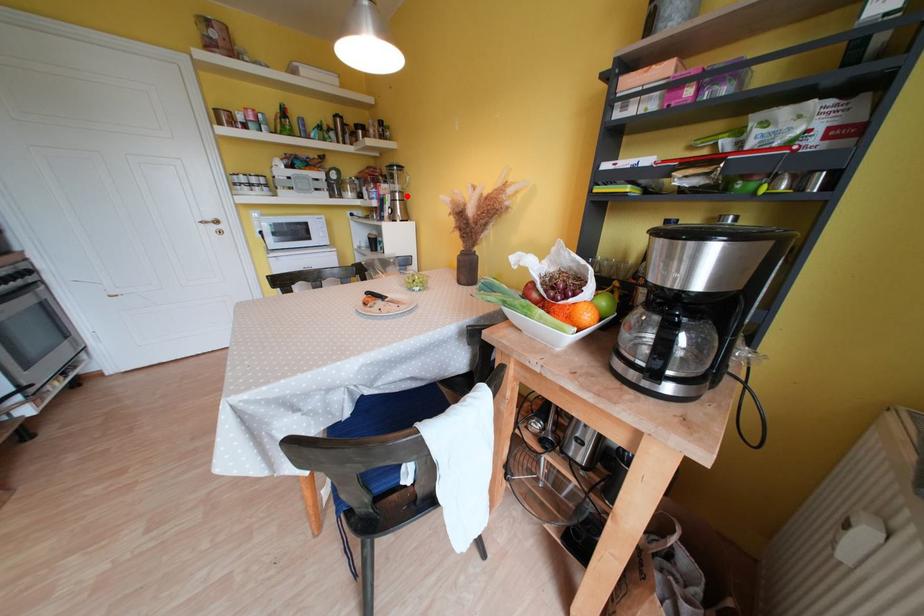
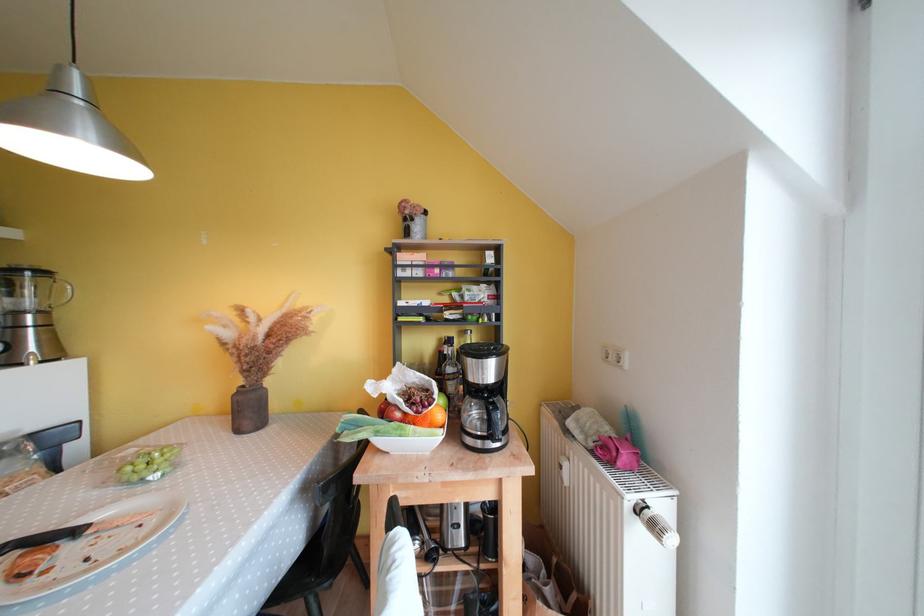
Locate, in the second image, the point that corresponds to the highlighted location in the first image.

(49, 315)